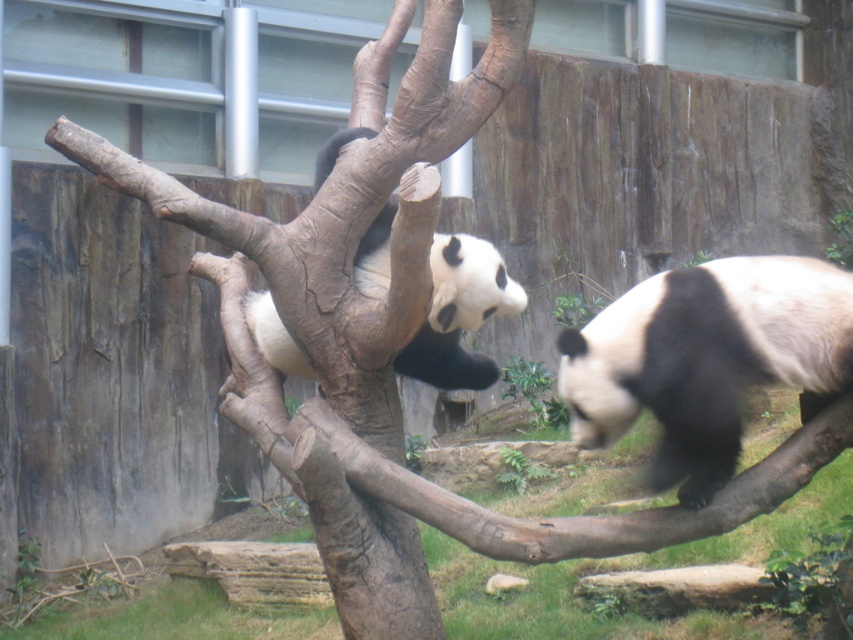
Between point (668, 371) and point (422, 374), which one is positioned behind?

Positioned behind is point (422, 374).

Is point (834, 394) positioned behind point (299, 369)?

That is False.

Locate an element on the screen. black fuzzy panda at right is located at coordinates (706, 358).